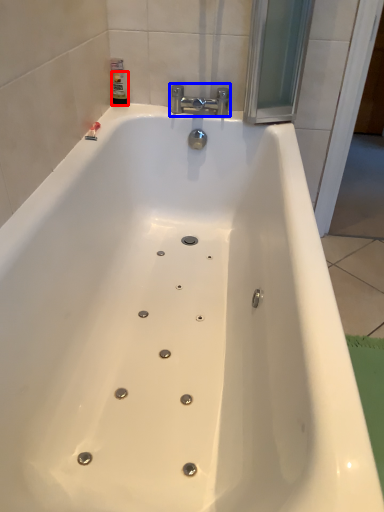
Question: Which object appears farthest to the camera in this image, toiletry (highlighted by a red box) or tap (highlighted by a blue box)?

Choices:
 (A) toiletry
 (B) tap

Answer: (A)